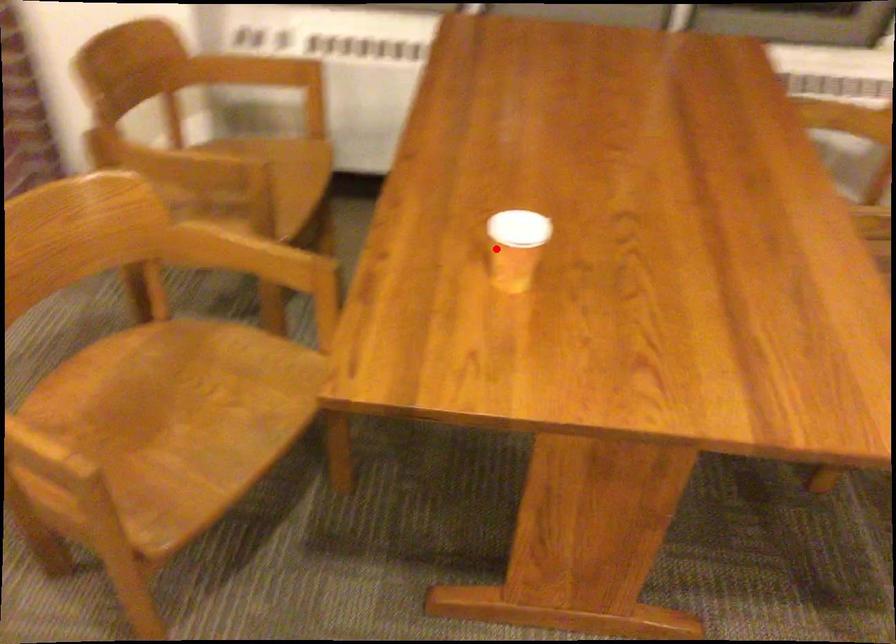
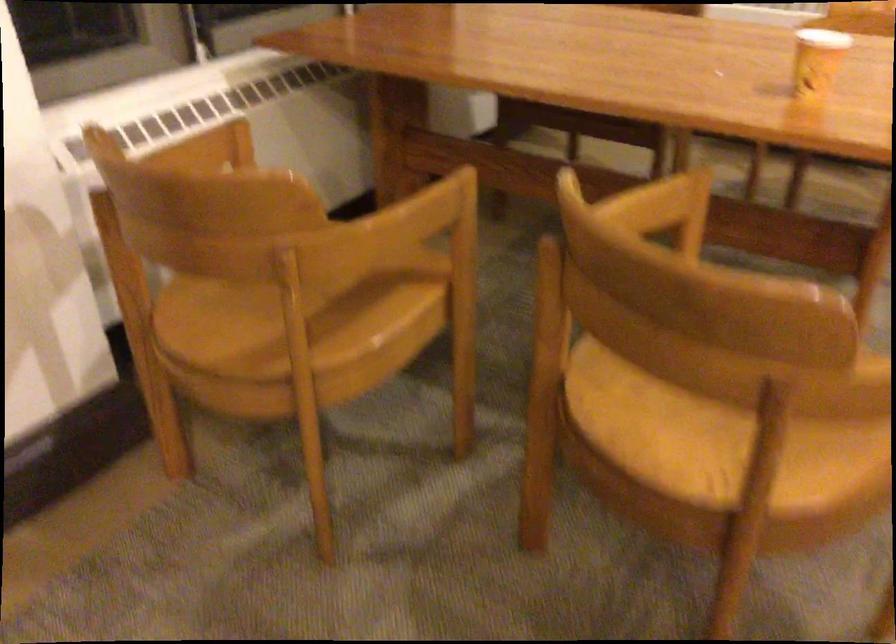
In the second image, find the point that corresponds to the highlighted location in the first image.

(816, 61)